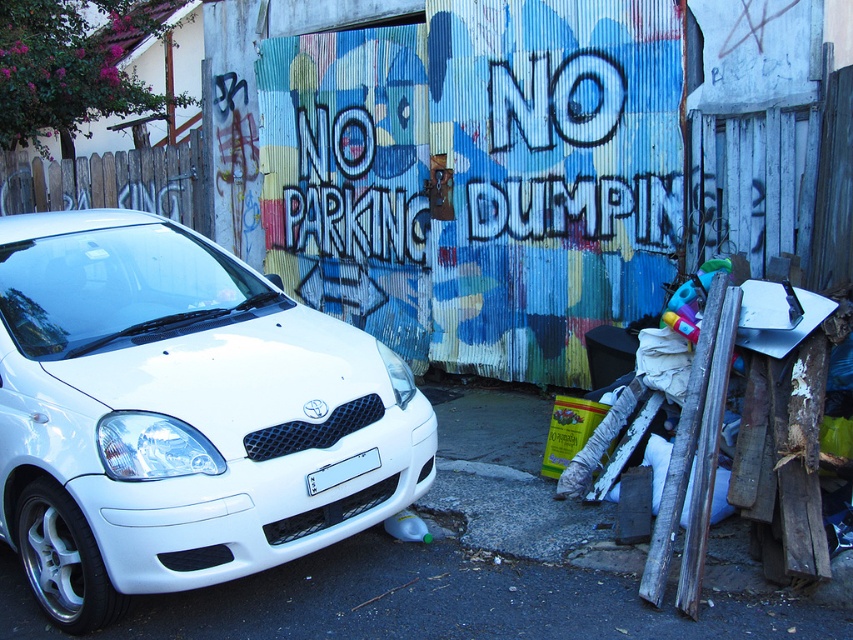
You are a delivery driver who needs to photograph the license plate of the white glossy car at left. However, the white plastic license plate at center is partially hidden by the car. Can you move the car to get a clear photo of the license plate?

The white glossy car at left is in front of the white plastic license plate at center, so moving the car would allow you to take a clear photo of the license plate.

You are a parking attendant checking the license plate of the white glossy car at left. Where should you look to find the white plastic license plate at center?

The white plastic license plate at center is located below the white glossy car at left.

You are a delivery person trying to park your van in this area. You see the white glossy car at left and the white plastic license plate at center. Which object would block your path more significantly when entering the parking spot?

The white glossy car at left would block your path more significantly when entering the parking spot because it is larger in size compared to the white plastic license plate at center.